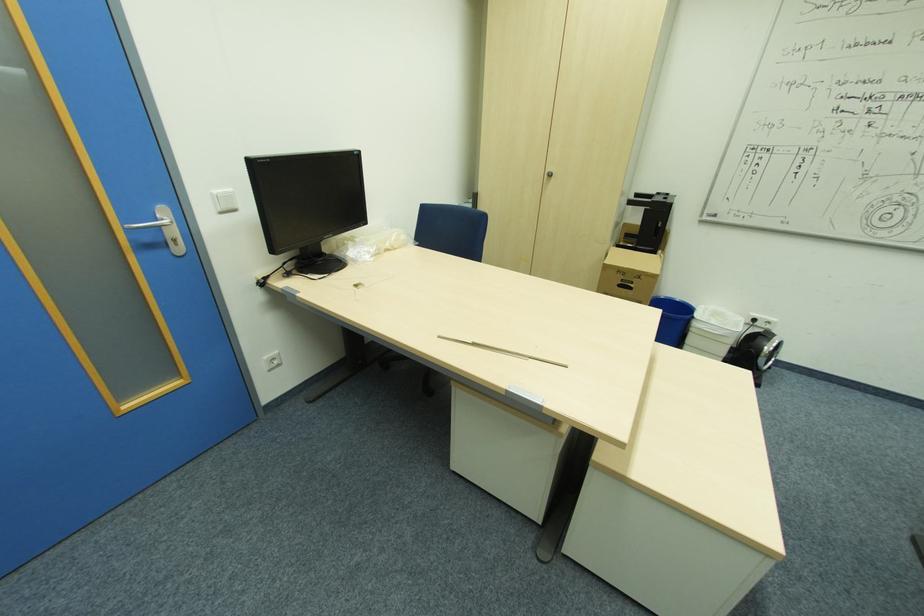
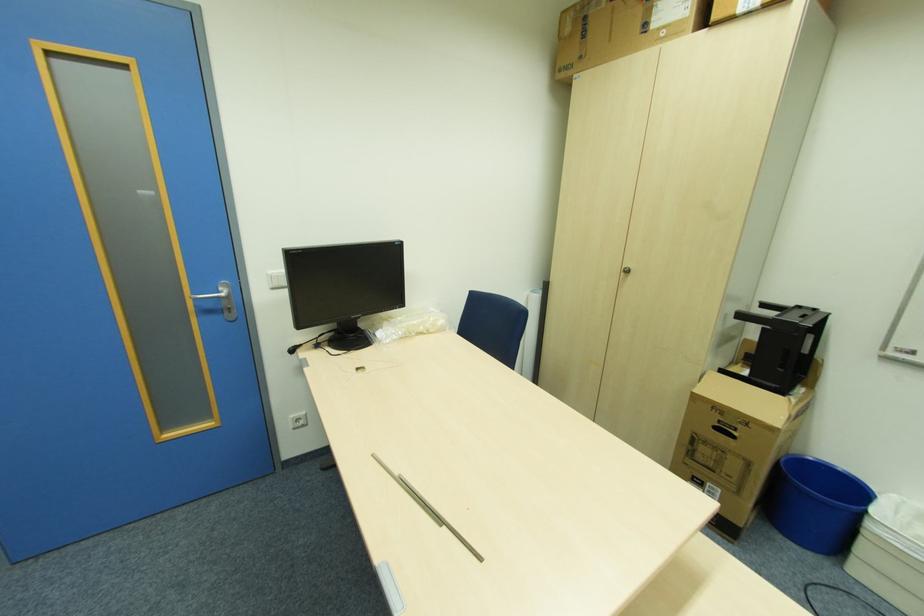
What movement of the cameraman would produce the second image?

The cameraman walked toward right, forward.